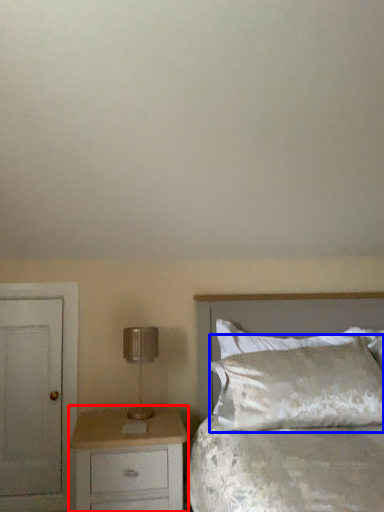
Question: Which point is further to the camera, chest of drawers (highlighted by a red box) or pillow (highlighted by a blue box)?

Choices:
 (A) chest of drawers
 (B) pillow

Answer: (B)